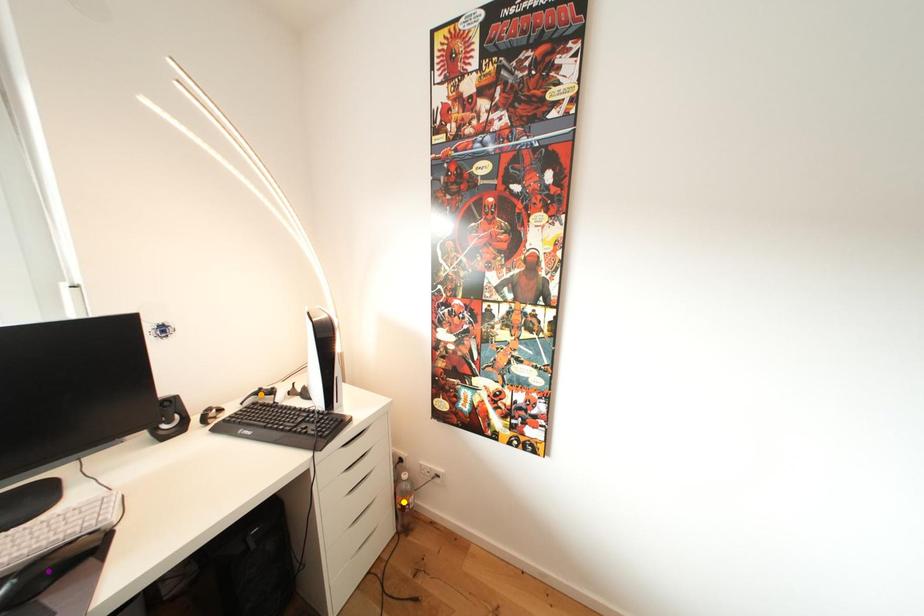
Order these from nearest to farthest:
- yellow point
- purple point
- orange point

purple point
orange point
yellow point